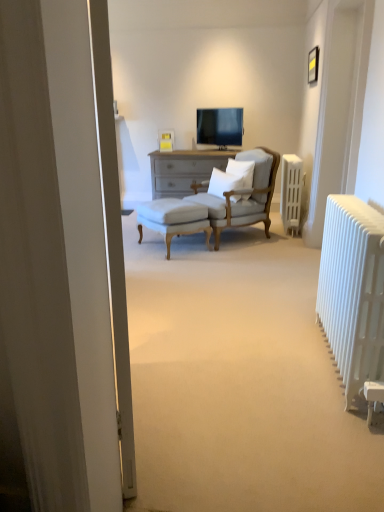
Question: Which direction should I rotate to look at white soft cushion at center, which appears as the second pillow when viewed from the right, — up or down?

Choices:
 (A) down
 (B) up

Answer: (B)

Question: Is white plastic radiator at right, the first radiator positioned from the back, located outside white soft pillow at center, the second pillow viewed from the left?

Choices:
 (A) no
 (B) yes

Answer: (B)

Question: Are white plastic radiator at right, the first radiator positioned from the back, and white soft pillow at center, the second pillow viewed from the left, located far from each other?

Choices:
 (A) yes
 (B) no

Answer: (B)

Question: Is white plastic radiator at right, arranged as the second radiator when ordered from the bottom, shorter than white soft pillow at center, the second pillow viewed from the left?

Choices:
 (A) yes
 (B) no

Answer: (B)

Question: Is white plastic radiator at right, the second radiator when ordered from left to right, positioned behind white soft pillow at center, which appears as the 1th pillow when viewed from the right?

Choices:
 (A) no
 (B) yes

Answer: (B)

Question: Is white plastic radiator at right, positioned as the first radiator in top-to-bottom order, bigger than white soft pillow at center, the second pillow viewed from the left?

Choices:
 (A) yes
 (B) no

Answer: (A)

Question: Is white plastic radiator at right, positioned as the first radiator in top-to-bottom order, facing away from white soft pillow at center, which appears as the 1th pillow when viewed from the right?

Choices:
 (A) no
 (B) yes

Answer: (A)

Question: Is white soft cushion at center, which ranks as the first pillow in left-to-right order, turned away from white metallic radiator at right, the 1th radiator viewed from the front?

Choices:
 (A) yes
 (B) no

Answer: (B)

Question: From a real-world perspective, does white soft cushion at center, which ranks as the first pillow in left-to-right order, sit lower than white metallic radiator at right, the first radiator positioned from the bottom?

Choices:
 (A) yes
 (B) no

Answer: (B)

Question: Is the position of white soft cushion at center, which ranks as the first pillow in left-to-right order, more distant than that of white metallic radiator at right, acting as the second radiator starting from the top?

Choices:
 (A) yes
 (B) no

Answer: (A)

Question: From a real-world perspective, does white soft cushion at center, which ranks as the first pillow in left-to-right order, stand above white metallic radiator at right, the 1th radiator viewed from the front?

Choices:
 (A) no
 (B) yes

Answer: (B)

Question: Considering the relative sizes of white soft cushion at center, which appears as the second pillow when viewed from the right, and white metallic radiator at right, the 1th radiator viewed from the front, in the image provided, is white soft cushion at center, which appears as the second pillow when viewed from the right, wider than white metallic radiator at right, the 1th radiator viewed from the front,?

Choices:
 (A) yes
 (B) no

Answer: (A)

Question: From the image's perspective, is white soft cushion at center, which appears as the second pillow when viewed from the right, below white metallic radiator at right, the 1th radiator viewed from the front?

Choices:
 (A) yes
 (B) no

Answer: (B)

Question: Is white upholstered stool at center wider than white metallic radiator at right, the first radiator positioned from the bottom?

Choices:
 (A) yes
 (B) no

Answer: (A)